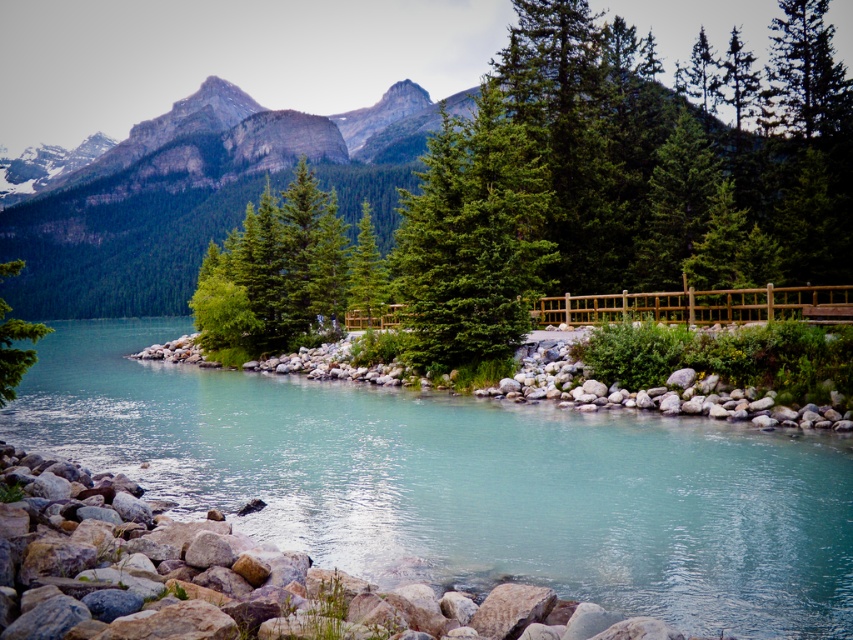
Does point (843, 451) come behind point (19, 260)?

No.

Locate an element on the screen. The image size is (853, 640). clear water at center is located at coordinates (466, 483).